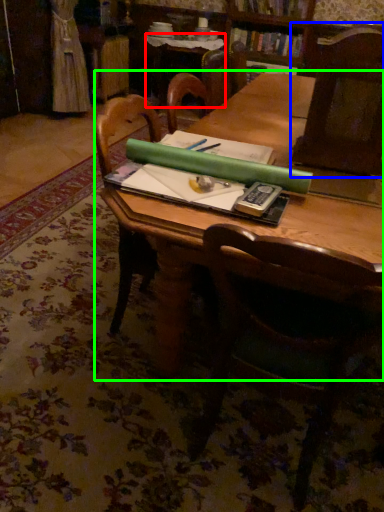
Question: Which object is the farthest from side table (highlighted by a red box)? Choose among these: chair (highlighted by a blue box) or table (highlighted by a green box).

Choices:
 (A) chair
 (B) table

Answer: (A)